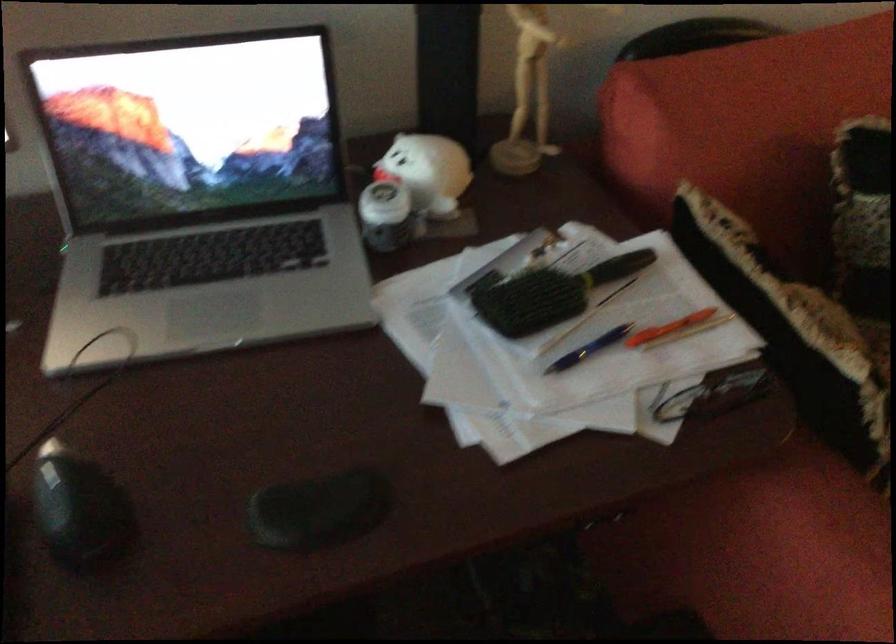
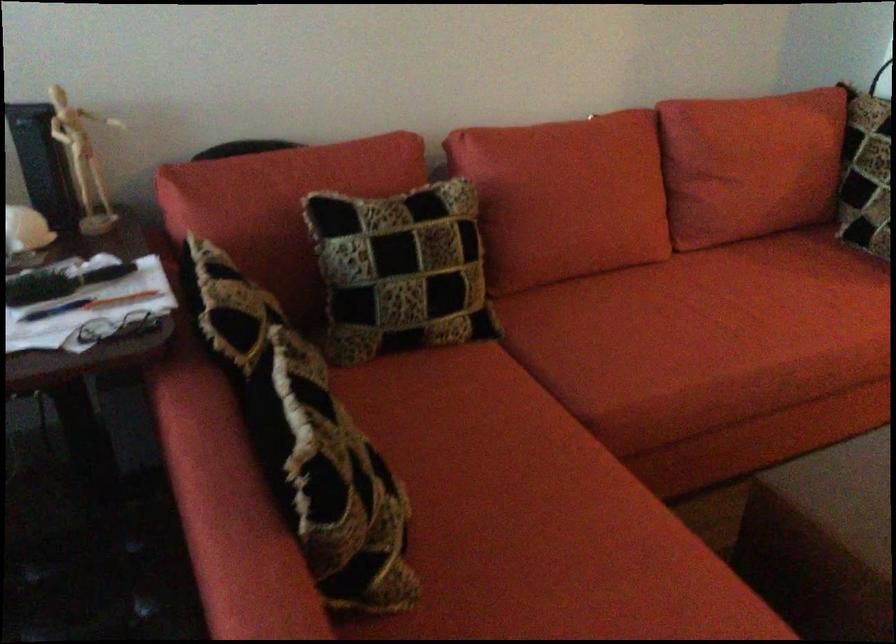
Question: The first image is from the beginning of the video and the second image is from the end. How did the camera likely rotate when shooting the video?

Choices:
 (A) Left
 (B) Right
 (C) Up
 (D) Down

Answer: (C)